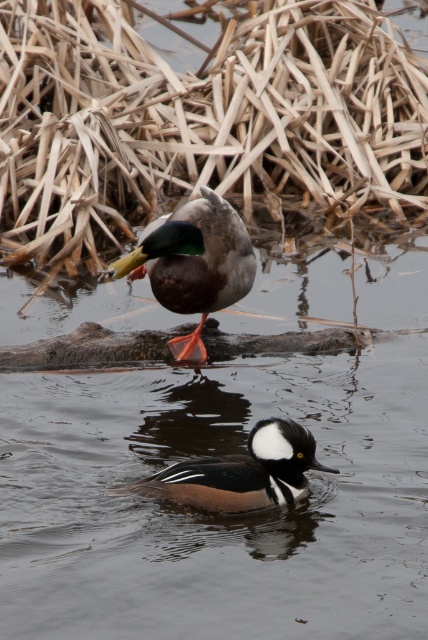
You are a photographer trying to capture a closeup of the shiny brown duck at center. However, there is a brown dry reed at upper center blocking your view. Can you adjust your position to avoid the reed and still see the duck?

The brown dry reed at upper center is located above the shiny brown duck at center, so if you lower your camera angle or move to the side, you can avoid the reed and still see the duck.

You are a birdwatcher observing the scene. You notice the brown dry reed at upper center and the brown speckled duck at center. Which object is positioned higher in the image?

The brown dry reed at upper center is positioned higher in the image than the brown speckled duck at center.

You are a birdwatcher trying to locate a specific reed in the image. The coordinates provided are for a particular reed. Based on the scene description, which reed is located at the point with coordinates (199,118)?

The point at coordinates (199,118) indicates the brown dry reed at upper center.